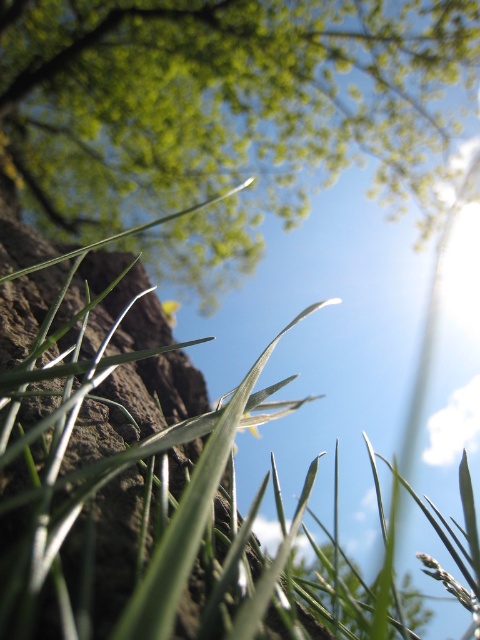
You are standing in a field and see the green leafy grass at lower left and the green leafy tree at center. Which object is located to the right of the other?

The green leafy grass at lower left is positioned on the left side of green leafy tree at center, so the tree is to the right of the grass.